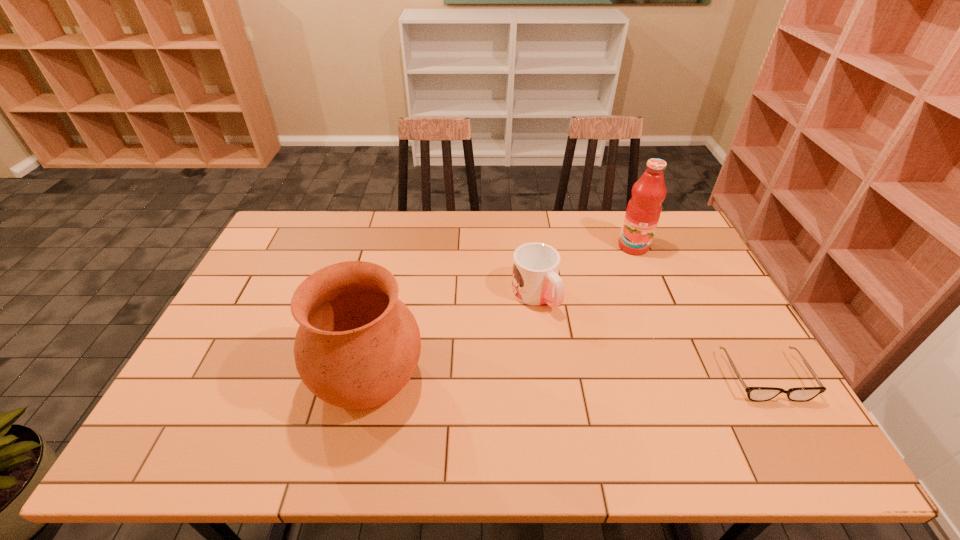
This screenshot has width=960, height=540. I want to click on vacant space located 0.310m on the front label of the farthest object, so click(629, 322).

Identify the location of vacant region located 0.310m on the side of the third nearest object with the handle. Image resolution: width=960 pixels, height=540 pixels. (622, 396).

I want to click on free space located 0.300m on the side of the third nearest object with the handle, so click(x=619, y=393).

Locate an element on the screen. Image resolution: width=960 pixels, height=540 pixels. free region located on the side of the third nearest object with the handle is located at coordinates (563, 330).

What are the coordinates of `object located in the far edge section of the desktop` in the screenshot? It's located at (643, 211).

Where is `pottery that is positioned at the near edge`? The image size is (960, 540). pottery that is positioned at the near edge is located at coordinates (357, 346).

At what (x,y) coordinates should I click in order to perform the action: click on spectacles located at the near edge. Please return your answer as a coordinate pair (x, y). Looking at the image, I should click on (758, 394).

Locate an element on the screen. The width and height of the screenshot is (960, 540). spectacles that is at the right edge is located at coordinates (758, 394).

Where is `fruit juice situated at the right edge`? fruit juice situated at the right edge is located at coordinates (643, 211).

This screenshot has width=960, height=540. Find the location of `object located at the far right corner`. object located at the far right corner is located at coordinates (643, 211).